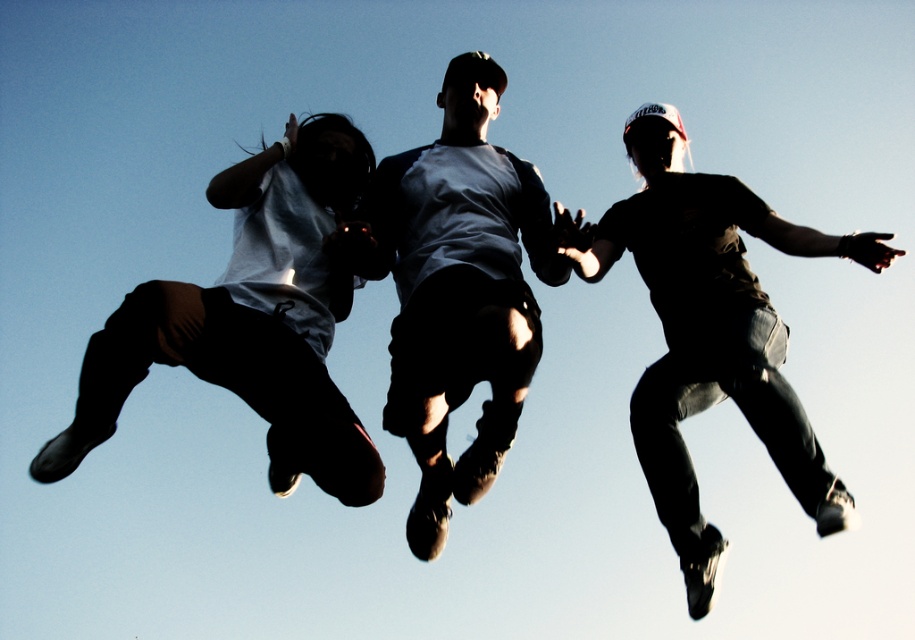
Can you confirm if matte blue shirt at center is wider than matte black pants at left?

No, matte blue shirt at center is not wider than matte black pants at left.

Describe the element at coordinates (456, 289) in the screenshot. I see `matte blue shirt at center` at that location.

Locate an element on the screen. The width and height of the screenshot is (915, 640). matte blue shirt at center is located at coordinates (456, 289).

Does matte blue shirt at center have a greater width compared to dark gray jeans at center?

Incorrect, matte blue shirt at center's width does not surpass dark gray jeans at center's.

The height and width of the screenshot is (640, 915). What do you see at coordinates (456, 289) in the screenshot?
I see `matte blue shirt at center` at bounding box center [456, 289].

Locate an element on the screen. This screenshot has width=915, height=640. matte blue shirt at center is located at coordinates (456, 289).

Who is taller, dark gray jeans at center or matte black pants at left?

With more height is dark gray jeans at center.

Which is in front, point (765, 339) or point (218, 378)?

Point (765, 339)

This screenshot has width=915, height=640. Identify the location of dark gray jeans at center. (711, 332).